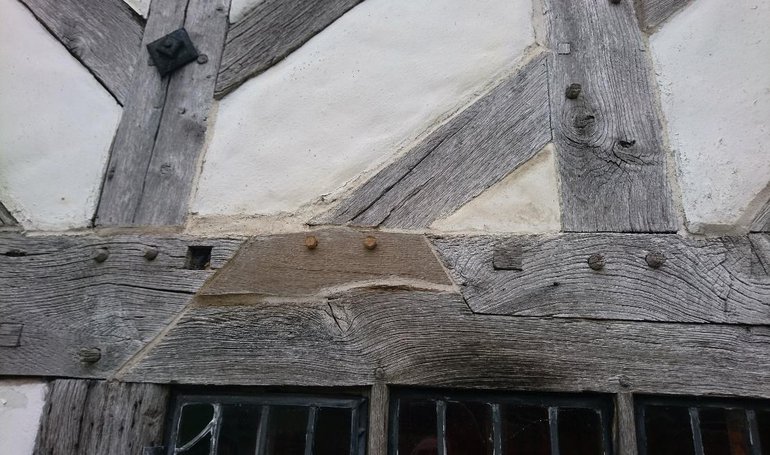
In order to click on horizontal metal rods in this screenshot , I will do `click(229, 395)`, `click(450, 395)`, `click(665, 405)`.